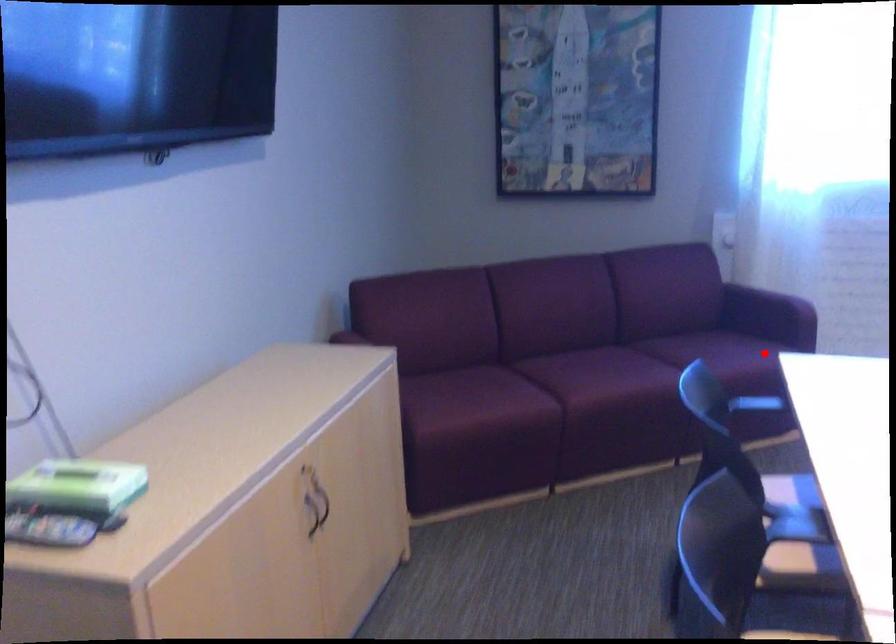
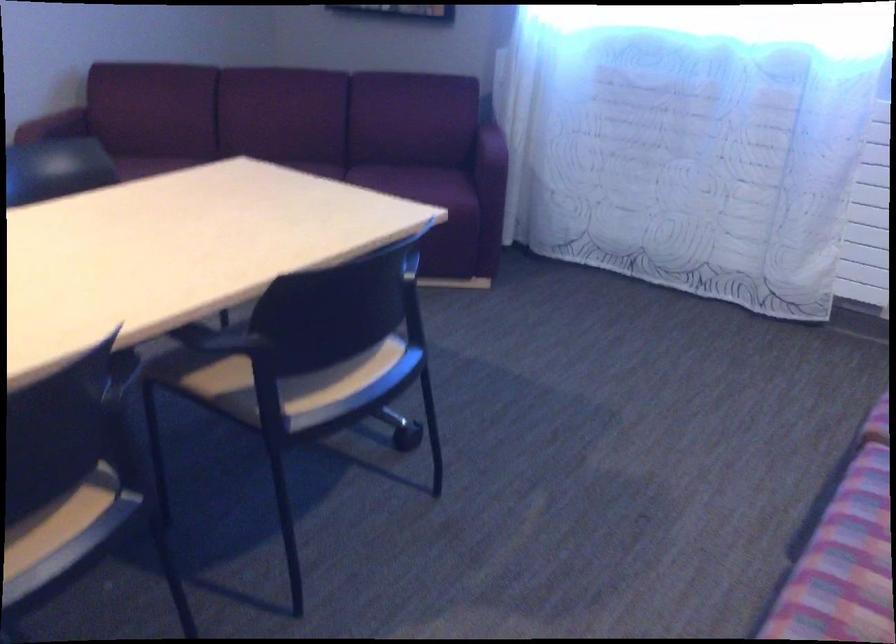
Where in the second image is the point corresponding to the highlighted location from the first image?

(426, 183)